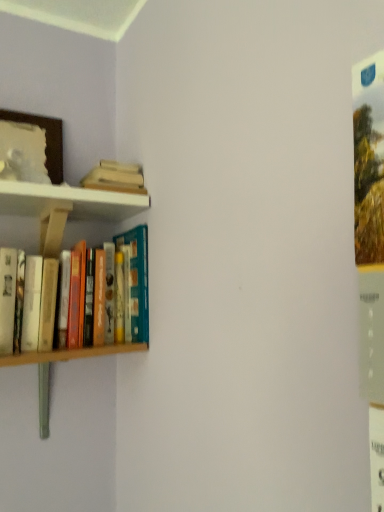
Question: From a real-world perspective, relative to hardcover book at upper left, the first book viewed from the top, is wooden picture frame at upper left vertically above or below?

Choices:
 (A) below
 (B) above

Answer: (B)

Question: Considering the positions of wooden picture frame at upper left and hardcover book at upper left, the first book viewed from the top, in the image, is wooden picture frame at upper left taller or shorter than hardcover book at upper left, the first book viewed from the top,?

Choices:
 (A) short
 (B) tall

Answer: (B)

Question: Estimate the real-world distances between objects in this image. Which object is farther from the wooden picture frame at upper left?

Choices:
 (A) hardcover book at upper left, the first book viewed from the top
 (B) hardcover books at left, the first book when ordered from bottom to top

Answer: (B)

Question: Considering the real-world distances, which object is closest to the hardcover books at left, the first book when ordered from bottom to top?

Choices:
 (A) wooden picture frame at upper left
 (B) hardcover book at upper left, arranged as the 2th book when ordered from the bottom

Answer: (B)